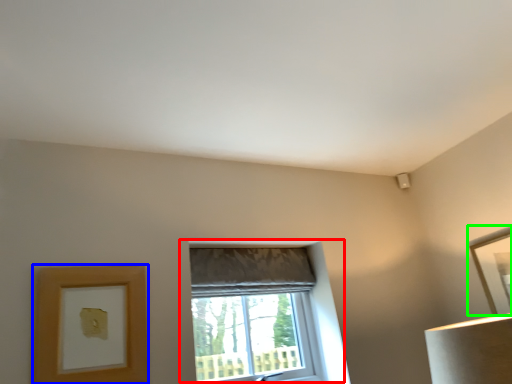
Question: Which object is the closest to the window (highlighted by a red box)? Choose among these: picture frame (highlighted by a blue box) or picture frame (highlighted by a green box).

Choices:
 (A) picture frame
 (B) picture frame

Answer: (A)